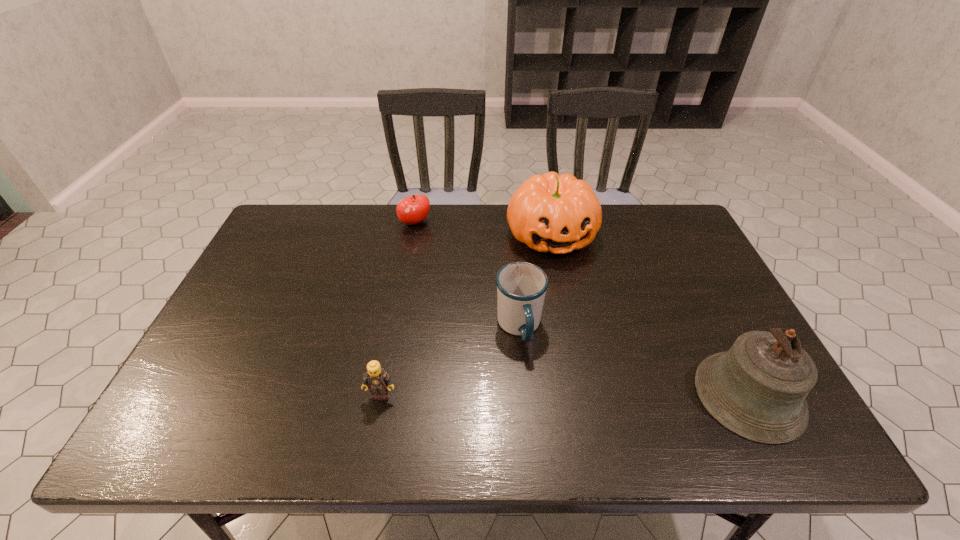
This screenshot has height=540, width=960. In order to click on free spot on the desktop that is between the Lego and the bell and is positioned on the stem of the apple in this screenshot , I will do `click(534, 395)`.

Identify the location of vacant space on the desktop that is between the Lego and the rightmost object and is positioned on the carved face of the pumpkin. Image resolution: width=960 pixels, height=540 pixels. (612, 395).

The width and height of the screenshot is (960, 540). Identify the location of free spot on the desktop that is between the Lego and the rightmost object and is positioned on the handle side of the mug. (544, 395).